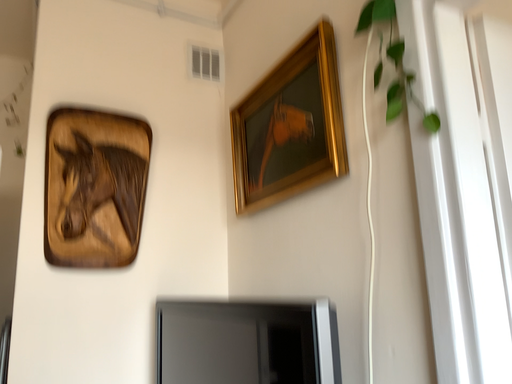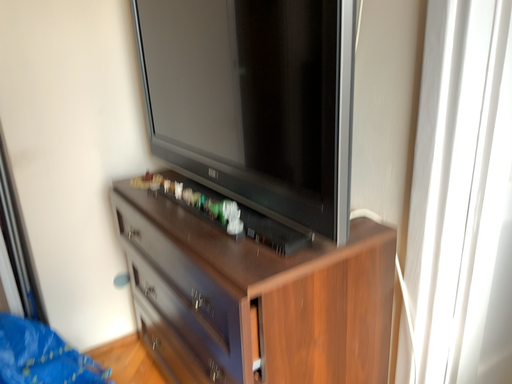
Question: How did the camera likely rotate when shooting the video?

Choices:
 (A) rotated downward
 (B) rotated upward

Answer: (A)